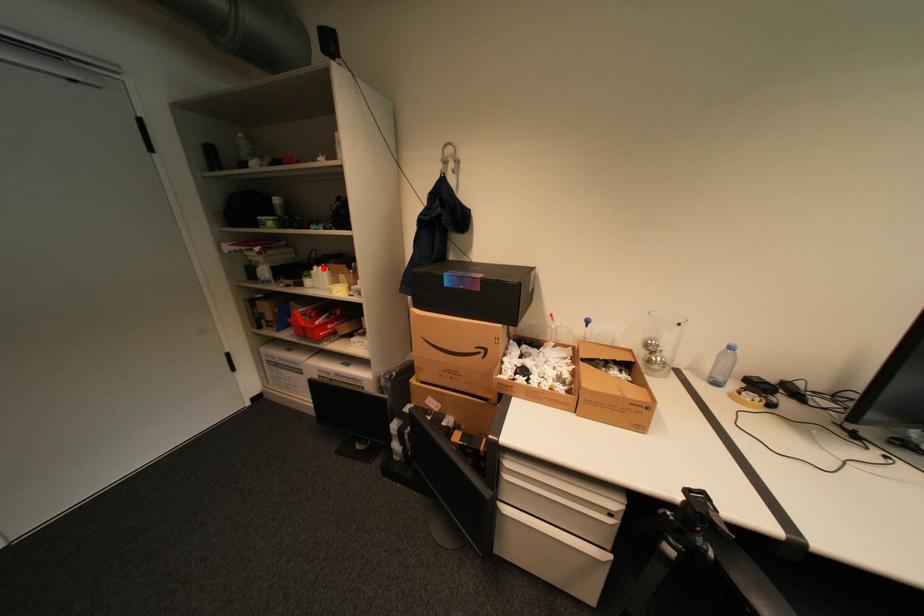
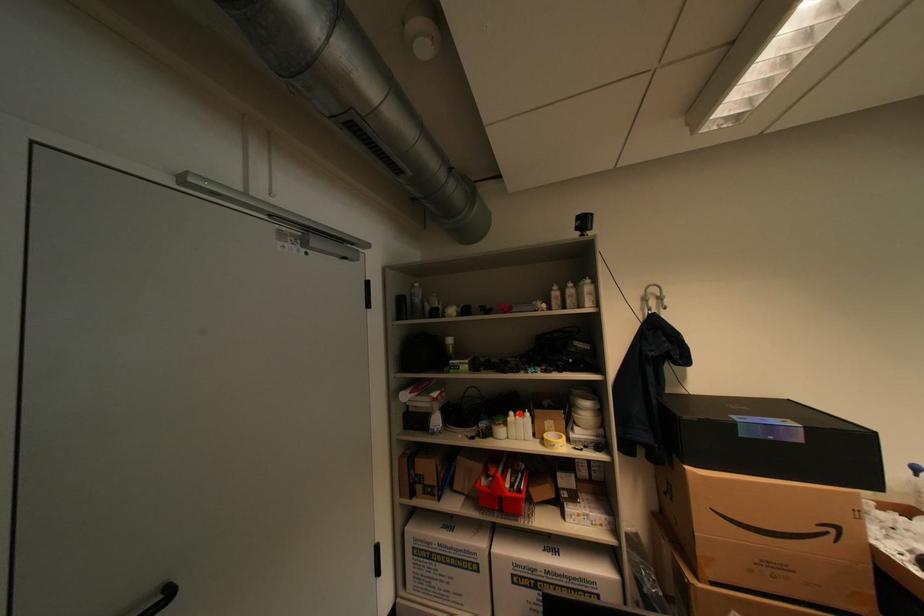
I am providing you with two images of the same scene from different viewpoints. A red point is marked on the first image and another point is marked on the second image. Does the point marked in image1 correspond to the same location as the one in image2?

Yes